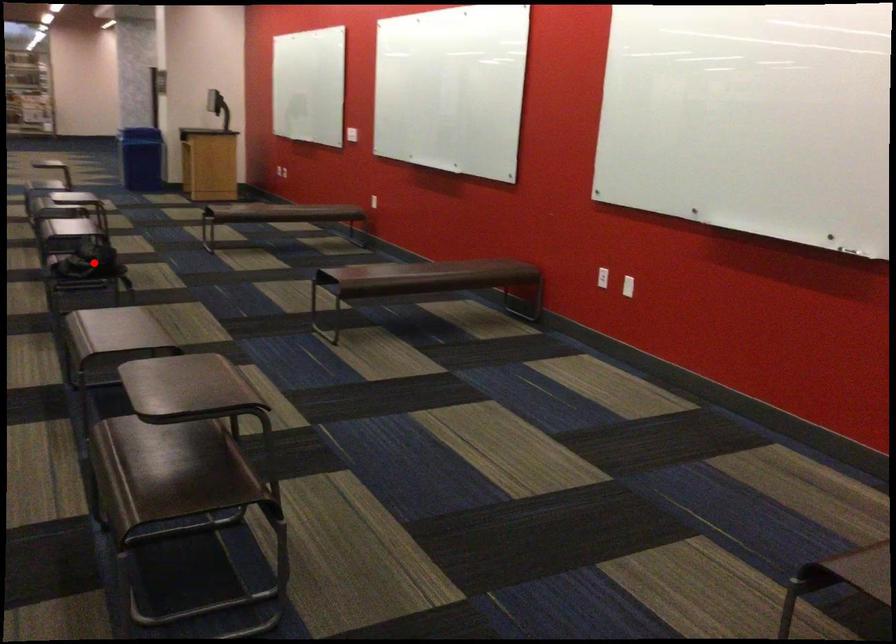
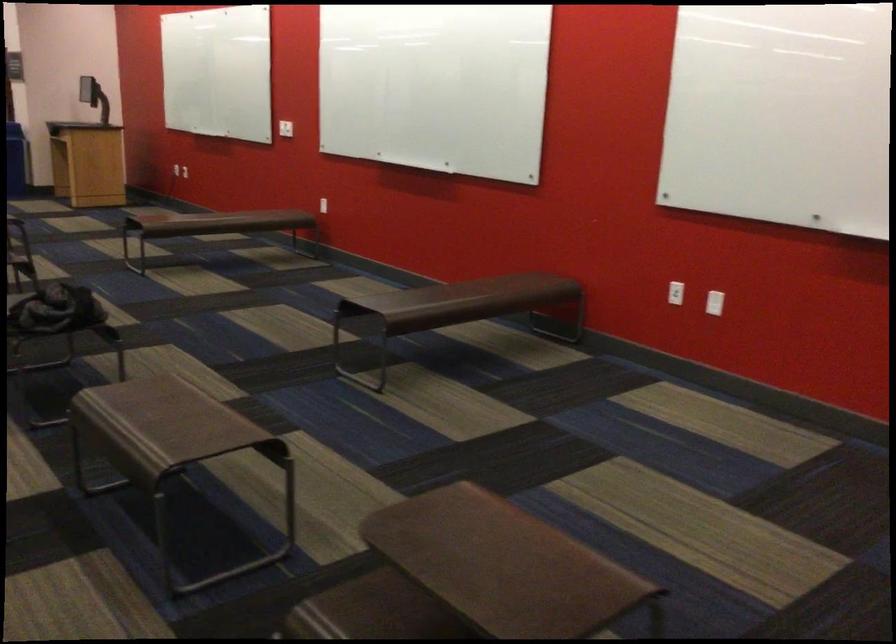
Question: I am providing you with two images of the same scene from different viewpoints. In image1, a red point is highlighted. Considering the same 3D point in image2, which of the following is correct?

Choices:
 (A) It is closer
 (B) It is farther

Answer: (A)